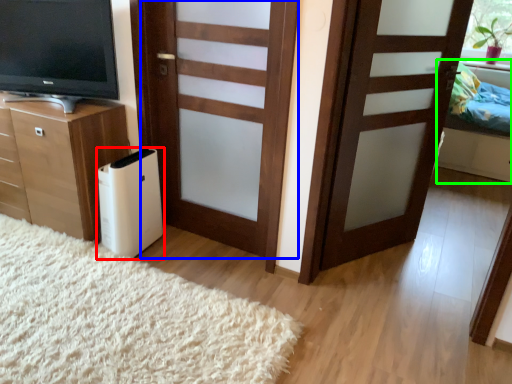
Question: Based on their relative distances, which object is nearer to appliance (highlighted by a red box)? Choose from door (highlighted by a blue box) and bed (highlighted by a green box).

Choices:
 (A) door
 (B) bed

Answer: (A)